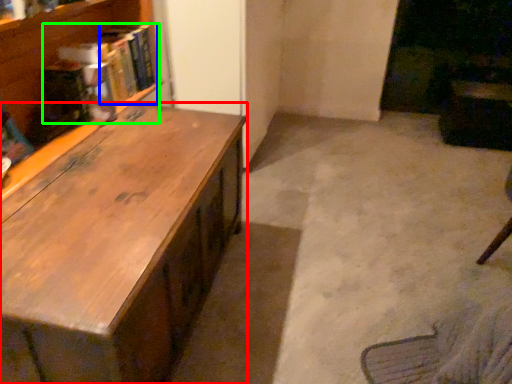
Question: Which is nearer to the desk (highlighted by a red box)? book (highlighted by a blue box) or book (highlighted by a green box).

Choices:
 (A) book
 (B) book

Answer: (B)